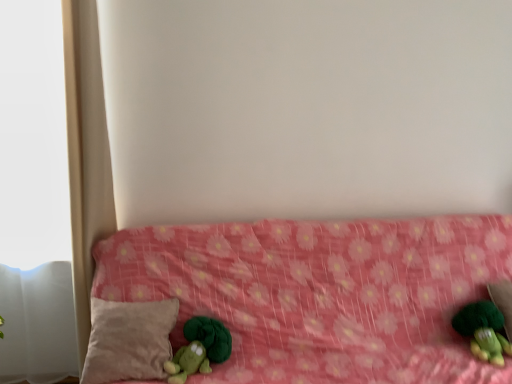
Question: Considering the relative sizes of beige soft pillow at lower left and green plush toy at lower left, positioned as the first toy in left-to-right order, in the image provided, is beige soft pillow at lower left bigger than green plush toy at lower left, positioned as the first toy in left-to-right order,?

Choices:
 (A) yes
 (B) no

Answer: (A)

Question: Does beige soft pillow at lower left appear on the right side of green plush toy at lower left, placed as the 2th toy when sorted from right to left?

Choices:
 (A) no
 (B) yes

Answer: (A)

Question: Is beige soft pillow at lower left wider than green plush toy at lower left, placed as the 2th toy when sorted from right to left?

Choices:
 (A) no
 (B) yes

Answer: (B)

Question: From a real-world perspective, is beige soft pillow at lower left over green plush toy at lower left, placed as the 2th toy when sorted from right to left?

Choices:
 (A) yes
 (B) no

Answer: (A)

Question: Is beige soft pillow at lower left next to green plush toy at lower left, positioned as the first toy in left-to-right order, and touching it?

Choices:
 (A) yes
 (B) no

Answer: (B)

Question: Considering the positions of point pos(208,372) and point pos(183,342), is point pos(208,372) closer or farther from the camera than point pos(183,342)?

Choices:
 (A) closer
 (B) farther

Answer: (A)

Question: Considering the relative positions of green plush toy at lower left, placed as the 2th toy when sorted from right to left, and pink fabric bed at center in the image provided, is green plush toy at lower left, placed as the 2th toy when sorted from right to left, to the left or to the right of pink fabric bed at center?

Choices:
 (A) left
 (B) right

Answer: (A)

Question: Looking at their shapes, would you say green plush toy at lower left, placed as the 2th toy when sorted from right to left, is wider or thinner than pink fabric bed at center?

Choices:
 (A) thin
 (B) wide

Answer: (A)

Question: From the image's perspective, is green plush toy at lower left, placed as the 2th toy when sorted from right to left, located above or below pink fabric bed at center?

Choices:
 (A) below
 (B) above

Answer: (B)

Question: Considering their positions, is beige soft pillow at lower left located in front of or behind pink fabric bed at center?

Choices:
 (A) front
 (B) behind

Answer: (B)

Question: In the image, is beige soft pillow at lower left on the left side or the right side of pink fabric bed at center?

Choices:
 (A) right
 (B) left

Answer: (B)

Question: Do you think beige soft pillow at lower left is within pink fabric bed at center, or outside of it?

Choices:
 (A) inside
 (B) outside

Answer: (A)

Question: Does point (162, 340) appear closer or farther from the camera than point (236, 370)?

Choices:
 (A) farther
 (B) closer

Answer: (B)

Question: In terms of width, does beige soft pillow at lower left look wider or thinner when compared to green plush toy at lower left, placed as the 2th toy when sorted from right to left?

Choices:
 (A) thin
 (B) wide

Answer: (B)

Question: Is beige soft pillow at lower left taller or shorter than green plush toy at lower left, positioned as the first toy in left-to-right order?

Choices:
 (A) short
 (B) tall

Answer: (B)